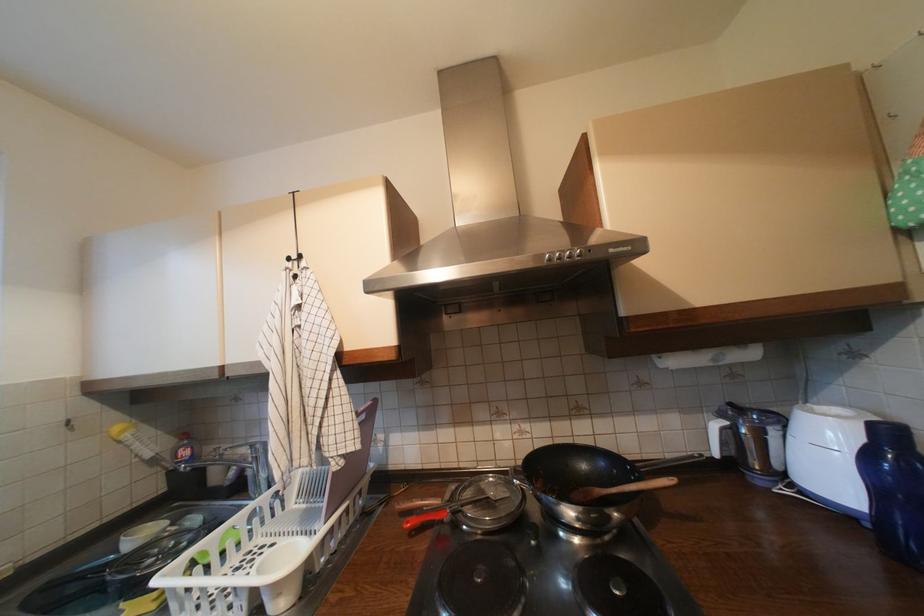
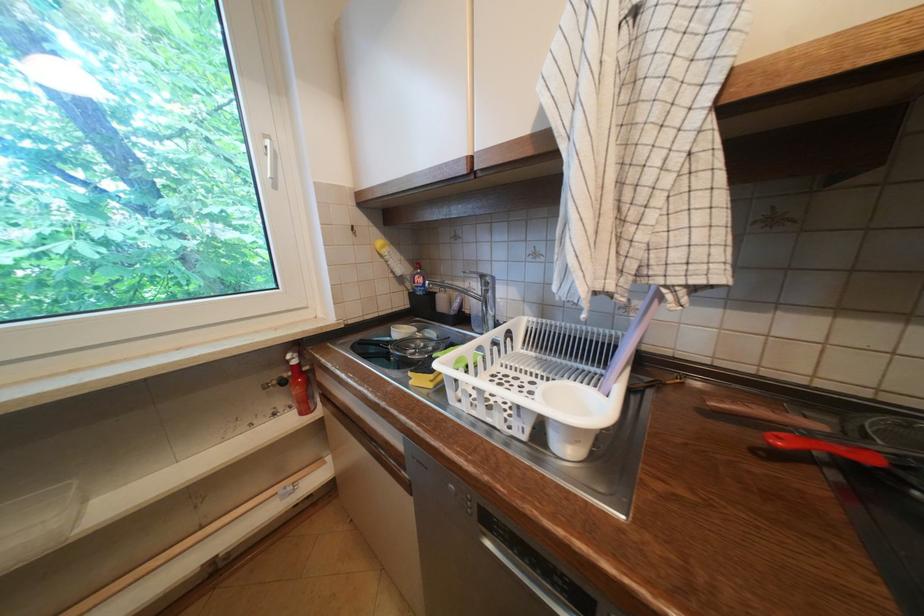
Question: I am providing you with two images of the same scene from different viewpoints. Please identify which objects are invisible in image2.

Choices:
 (A) red spray bottle
 (B) white window handle
 (C) white cup
 (D) none of these

Answer: (D)